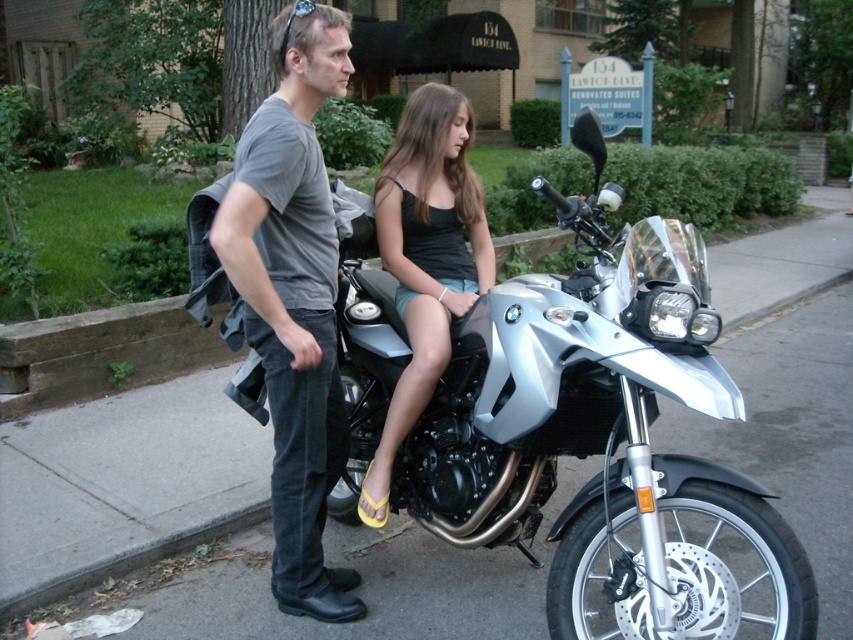
You are standing at point (x=320, y=412) and want to walk to point (x=700, y=636). Which direction should you move in relation to the silver BMW motorcycle?

You should move forward in the direction away from the silver BMW motorcycle because point (x=700, y=636) is in front of point (x=320, y=412).